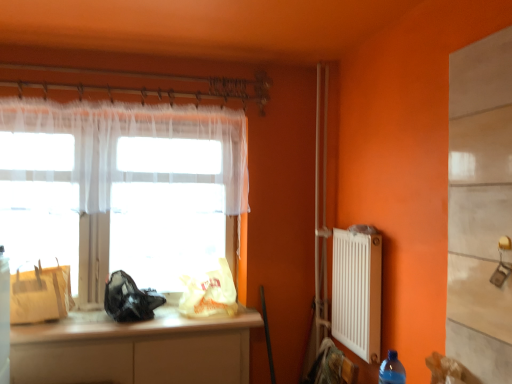
Question: From the image's perspective, does white sheer curtain at upper left appear lower than white plastic radiator at right?

Choices:
 (A) yes
 (B) no

Answer: (B)

Question: From a real-world perspective, is white sheer curtain at upper left on white plastic radiator at right?

Choices:
 (A) yes
 (B) no

Answer: (A)

Question: Considering the relative sizes of white sheer curtain at upper left and white plastic radiator at right in the image provided, is white sheer curtain at upper left smaller than white plastic radiator at right?

Choices:
 (A) no
 (B) yes

Answer: (A)

Question: Is white plastic radiator at right inside white sheer curtain at upper left?

Choices:
 (A) no
 (B) yes

Answer: (A)

Question: Is white sheer curtain at upper left further to camera compared to white plastic radiator at right?

Choices:
 (A) yes
 (B) no

Answer: (A)

Question: Is white sheer curtain at upper left at the right side of white plastic radiator at right?

Choices:
 (A) yes
 (B) no

Answer: (B)

Question: Is translucent fabric at left bigger than matte yellow paper bag at left, arranged as the first bag when viewed from the left?

Choices:
 (A) no
 (B) yes

Answer: (B)

Question: Is translucent fabric at left facing away from matte yellow paper bag at left, arranged as the first bag when viewed from the left?

Choices:
 (A) no
 (B) yes

Answer: (B)

Question: Does translucent fabric at left come behind matte yellow paper bag at left, which appears as the 3th bag when viewed from the right?

Choices:
 (A) no
 (B) yes

Answer: (B)

Question: From the image's perspective, does translucent fabric at left appear lower than matte yellow paper bag at left, which appears as the 3th bag when viewed from the right?

Choices:
 (A) yes
 (B) no

Answer: (B)

Question: From the image's perspective, does translucent fabric at left appear higher than matte yellow paper bag at left, arranged as the first bag when viewed from the left?

Choices:
 (A) yes
 (B) no

Answer: (A)

Question: Is translucent fabric at left at the right side of matte yellow paper bag at left, arranged as the first bag when viewed from the left?

Choices:
 (A) no
 (B) yes

Answer: (B)

Question: From a real-world perspective, does matte yellow paper bag at left, arranged as the first bag when viewed from the left, stand above translucent fabric at left?

Choices:
 (A) no
 (B) yes

Answer: (A)